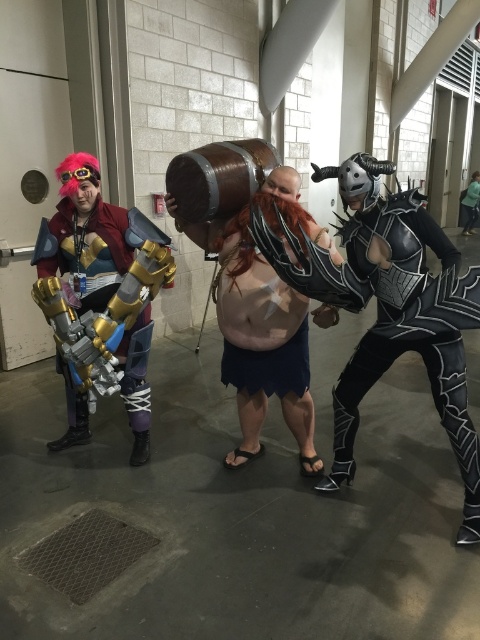
Question: Does black leather armor at right have a smaller size compared to brushed metal armor at left?

Choices:
 (A) yes
 (B) no

Answer: (B)

Question: Which point is farther to the camera?

Choices:
 (A) wooden barrel at center
 (B) black leather armor at right
 (C) brushed metal armor at left

Answer: (C)

Question: Observing the image, what is the correct spatial positioning of black leather armor at right in reference to wooden barrel at center?

Choices:
 (A) below
 (B) above

Answer: (A)

Question: Which object is farther from the camera taking this photo?

Choices:
 (A) black leather armor at right
 (B) wooden barrel at center

Answer: (B)

Question: Which object is farther from the camera taking this photo?

Choices:
 (A) brushed metal armor at left
 (B) black leather armor at right
 (C) wooden barrel at center

Answer: (A)

Question: Is black leather armor at right to the left of wooden barrel at center from the viewer's perspective?

Choices:
 (A) no
 (B) yes

Answer: (A)